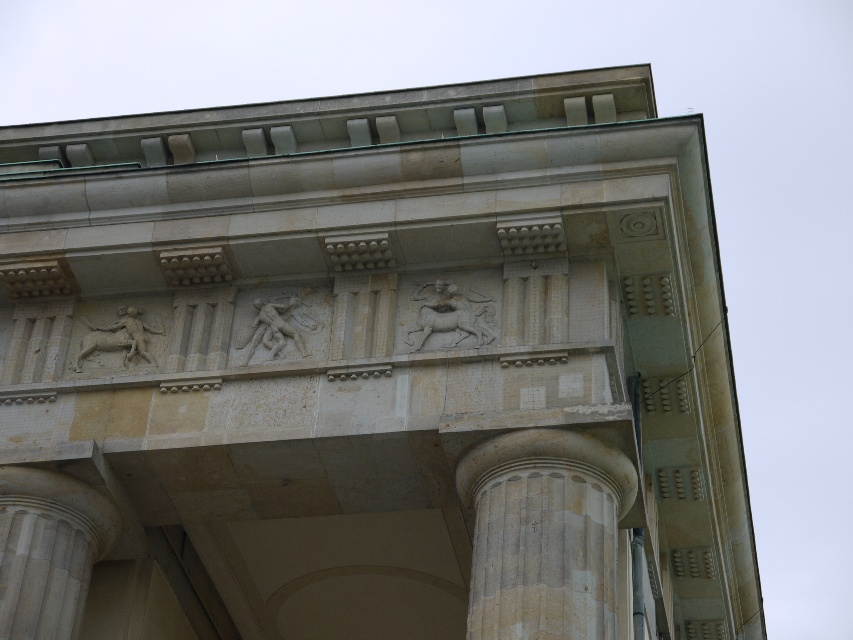
Is smooth stone column at center below smooth stone column at lower left?

Yes.

Which is more to the right, smooth stone column at center or smooth stone column at lower left?

smooth stone column at center is more to the right.

Which is behind, point (509, 520) or point (51, 563)?

Point (51, 563)

Where is `smooth stone column at center`? This screenshot has width=853, height=640. smooth stone column at center is located at coordinates (544, 534).